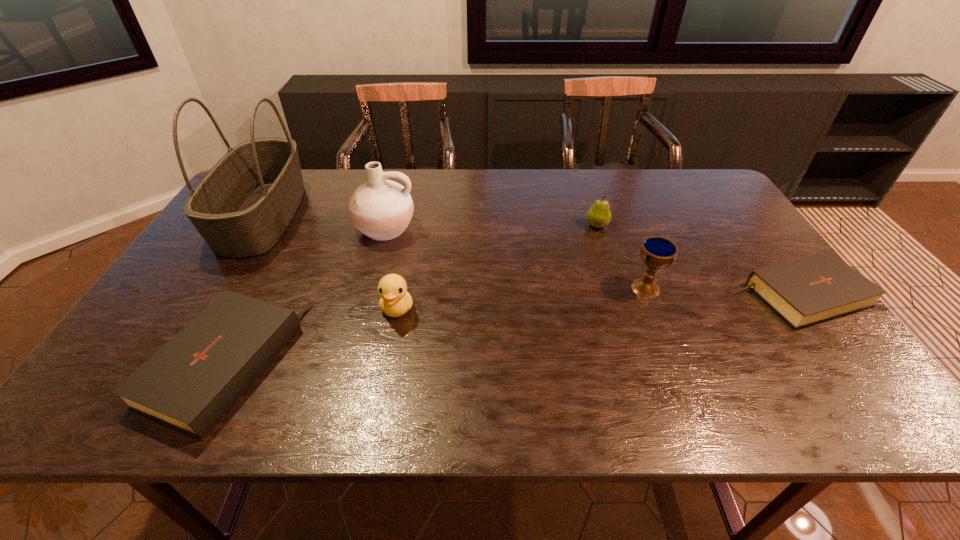
You are a GUI agent. You are given a task and a screenshot of the screen. Output one action in this format:
    pyautogui.click(x=<x>, y=<y>)
    Task: Click on the left Bible
    The width and height of the screenshot is (960, 540).
    Given the screenshot: What is the action you would take?
    pyautogui.click(x=189, y=384)

Locate an element on the screen. The width and height of the screenshot is (960, 540). the taller Bible is located at coordinates (189, 384).

At what (x,y) coordinates should I click in order to perform the action: click on the shortest object. Please return your answer as a coordinate pair (x, y). Image resolution: width=960 pixels, height=540 pixels. Looking at the image, I should click on (810, 290).

Find the location of a particular element. Image resolution: width=960 pixels, height=540 pixels. the rightmost object is located at coordinates [810, 290].

This screenshot has height=540, width=960. I want to click on the tallest object, so click(241, 208).

I want to click on duck, so click(x=395, y=301).

Locate an element on the screen. pear is located at coordinates (599, 215).

Identify the location of pottery. (381, 209).

Locate an element on the screen. chalice is located at coordinates (657, 252).

Where is `free space located on the right of the left Bible`? This screenshot has width=960, height=540. free space located on the right of the left Bible is located at coordinates (444, 364).